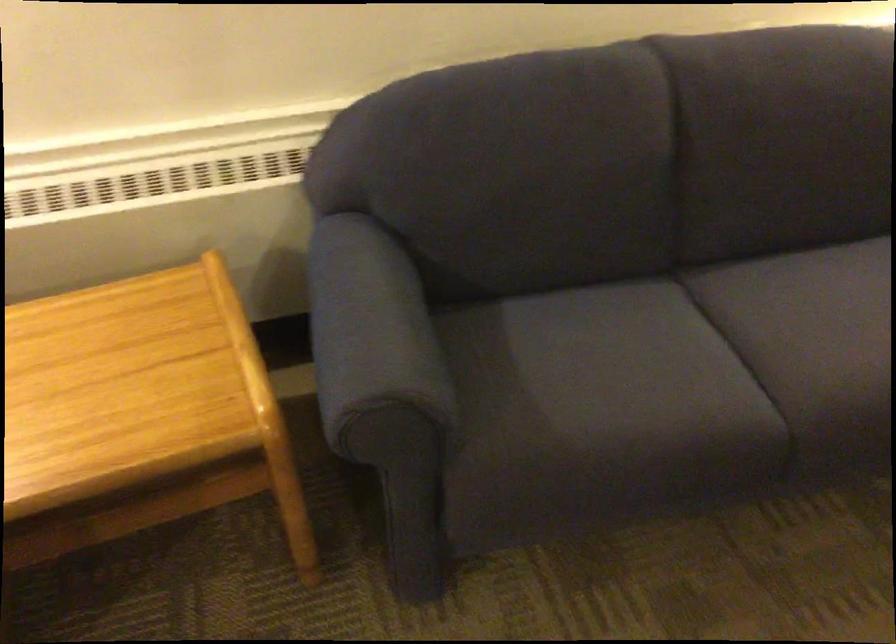
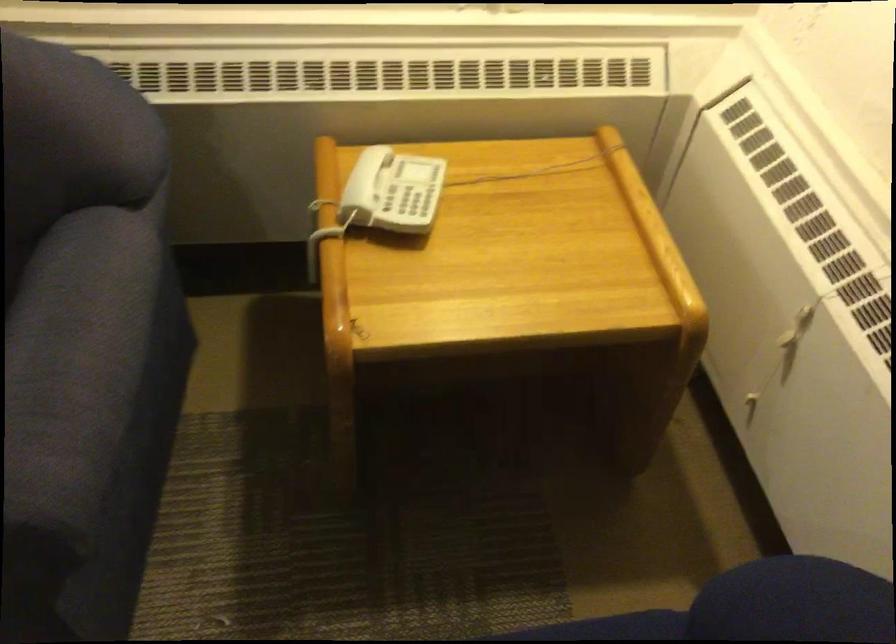
Question: What movement of the cameraman would produce the second image?

Choices:
 (A) Left
 (B) Right
 (C) Forward
 (D) Backward

Answer: (B)